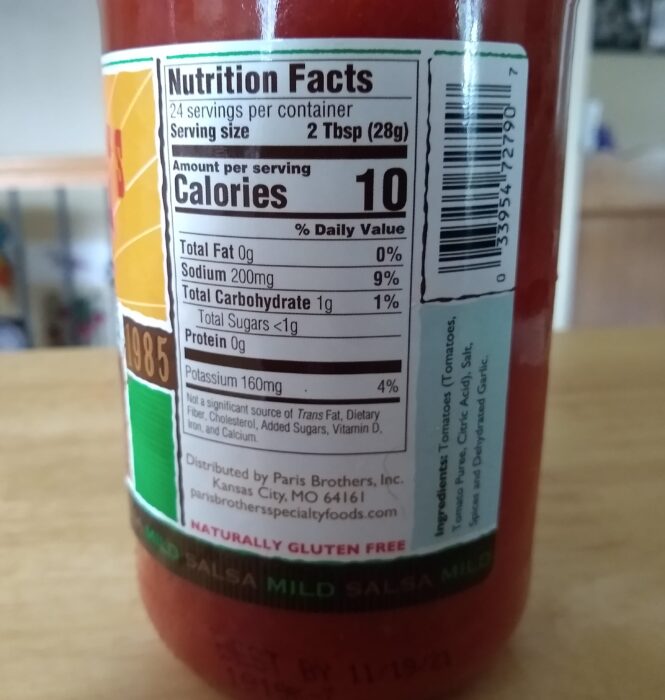
Find the location of a particular element. The width and height of the screenshot is (665, 700). glass jar is located at coordinates (283, 648), (529, 279).